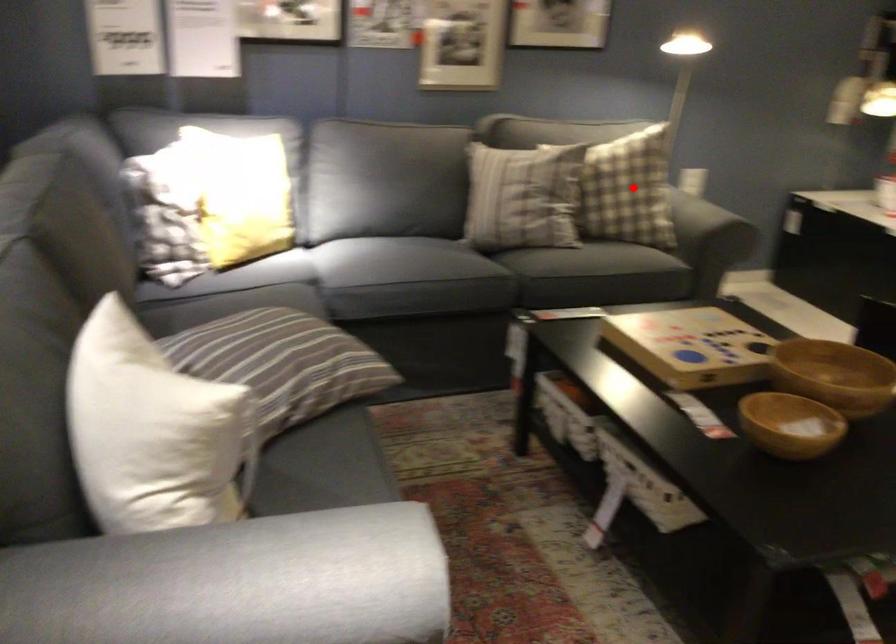
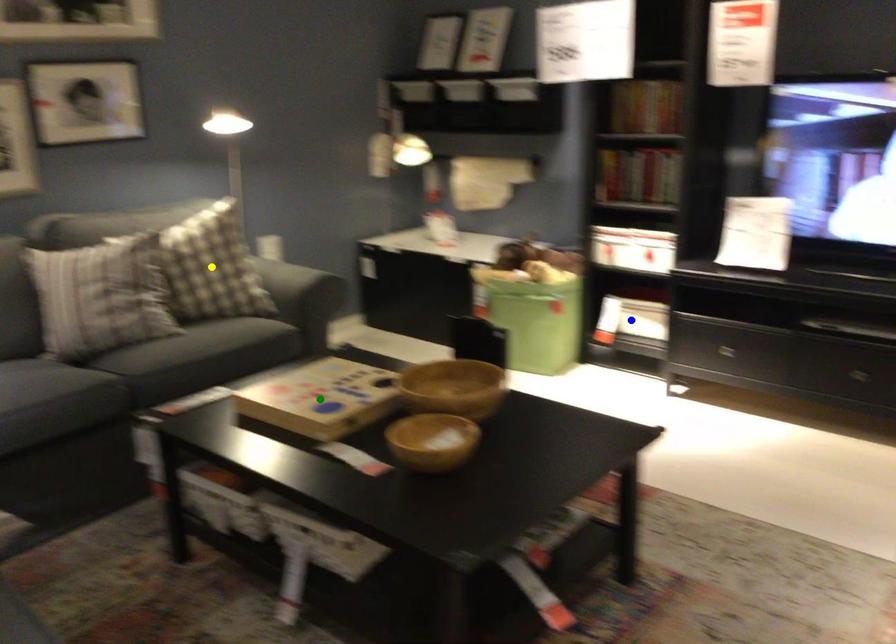
Question: I am providing you with two images of the same scene from different viewpoints. A red point is marked on the first image. You are given multiple points on the second image. Which mark in image 2 goes with the point in image 1?

Choices:
 (A) blue point
 (B) green point
 (C) yellow point

Answer: (C)